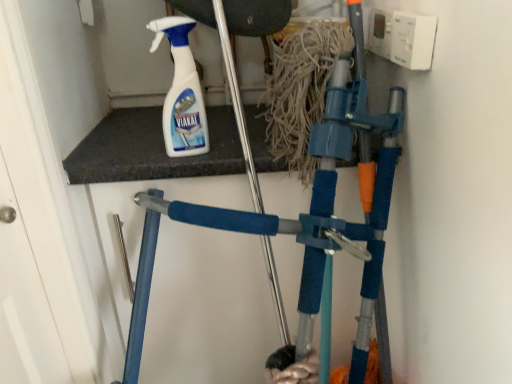
Question: Is blue foam crutch at center outside of white plastic spray bottle at upper center?

Choices:
 (A) no
 (B) yes

Answer: (B)

Question: Is white plastic spray bottle at upper center a part of blue foam crutch at center?

Choices:
 (A) yes
 (B) no

Answer: (B)

Question: Is blue foam crutch at center next to white plastic spray bottle at upper center and touching it?

Choices:
 (A) yes
 (B) no

Answer: (B)

Question: From the image's perspective, is blue foam crutch at center over white plastic spray bottle at upper center?

Choices:
 (A) yes
 (B) no

Answer: (B)

Question: From a real-world perspective, does blue foam crutch at center stand above white plastic spray bottle at upper center?

Choices:
 (A) yes
 (B) no

Answer: (B)

Question: From the image's perspective, is blue foam crutch at center below white plastic spray bottle at upper center?

Choices:
 (A) yes
 (B) no

Answer: (A)

Question: Considering the relative sizes of white plastic spray bottle at upper center and blue foam crutch at center in the image provided, is white plastic spray bottle at upper center wider than blue foam crutch at center?

Choices:
 (A) no
 (B) yes

Answer: (A)

Question: Considering the relative positions of white plastic spray bottle at upper center and blue foam crutch at center in the image provided, is white plastic spray bottle at upper center to the right of blue foam crutch at center from the viewer's perspective?

Choices:
 (A) no
 (B) yes

Answer: (A)

Question: Considering the relative positions of white plastic spray bottle at upper center and blue foam crutch at center in the image provided, is white plastic spray bottle at upper center to the left of blue foam crutch at center from the viewer's perspective?

Choices:
 (A) yes
 (B) no

Answer: (A)

Question: Does white plastic spray bottle at upper center have a lesser width compared to blue foam crutch at center?

Choices:
 (A) no
 (B) yes

Answer: (B)

Question: Does white plastic spray bottle at upper center have a smaller size compared to blue foam crutch at center?

Choices:
 (A) no
 (B) yes

Answer: (B)

Question: From the image's perspective, is white plastic spray bottle at upper center below blue foam crutch at center?

Choices:
 (A) no
 (B) yes

Answer: (A)

Question: Looking at their shapes, would you say blue foam crutch at center is wider or thinner than white plastic spray bottle at upper center?

Choices:
 (A) wide
 (B) thin

Answer: (A)